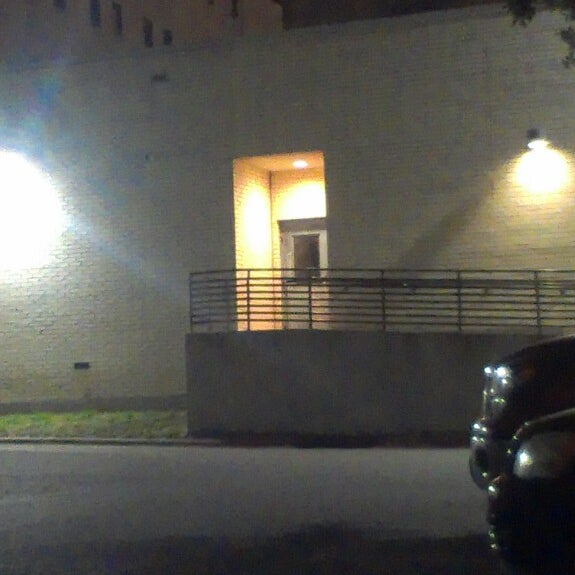
Locate an element on the screen. windows is located at coordinates 306,256, 58,5, 94,17, 118,23, 149,37, 168,41, 236,11, 210,3.